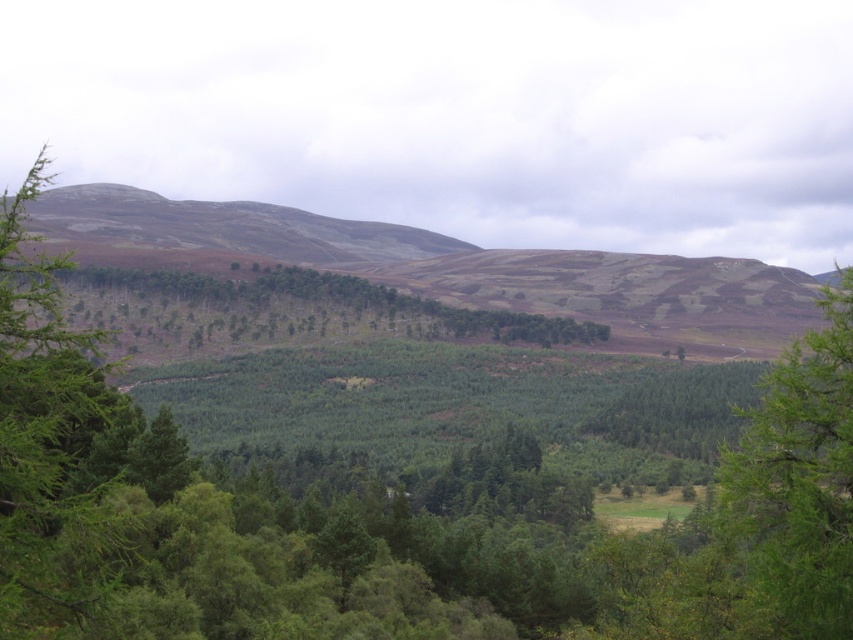
In the scene shown: You are standing in the middle of the forest looking at the two points marked in the image. Which point, point (82, 364) or point (77, 291), is closer to you?

Point (82, 364) is closer to you than point (77, 291).

You are standing at the point with coordinates point (402, 256) and want to walk to the point with coordinates point (457, 321). According to the image, will you be moving towards the foreground or the background?

Point (457, 321) is in front of point (402, 256), so moving from point (402, 256) to point (457, 321) means you are moving towards the foreground.